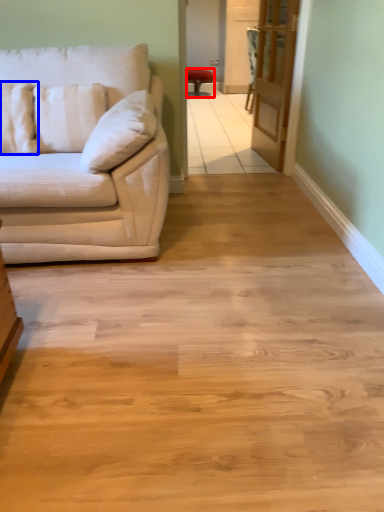
Question: Which object is closer to the camera taking this photo, chair (highlighted by a red box) or pillow (highlighted by a blue box)?

Choices:
 (A) chair
 (B) pillow

Answer: (B)